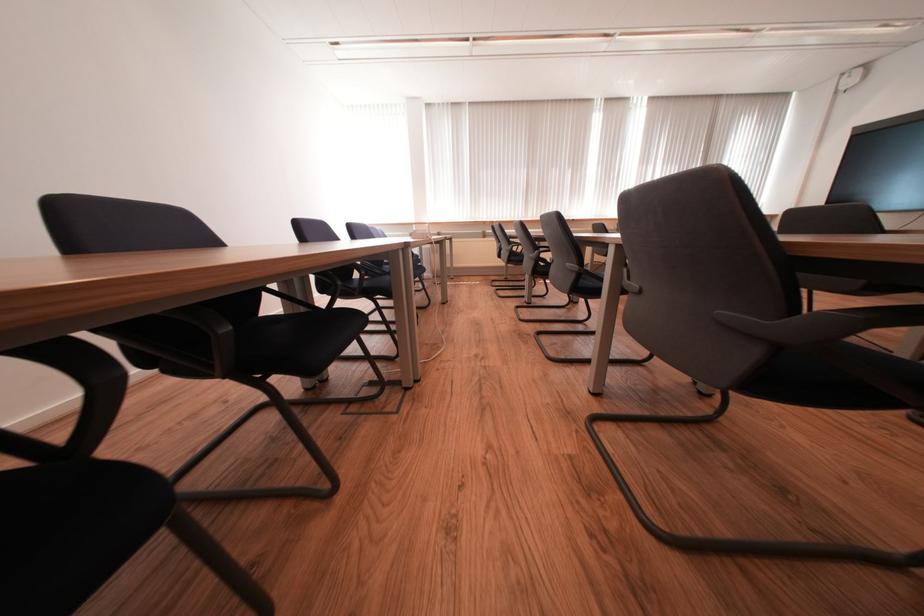
This screenshot has height=616, width=924. Describe the element at coordinates (892, 315) in the screenshot. I see `the grey chair armrest` at that location.